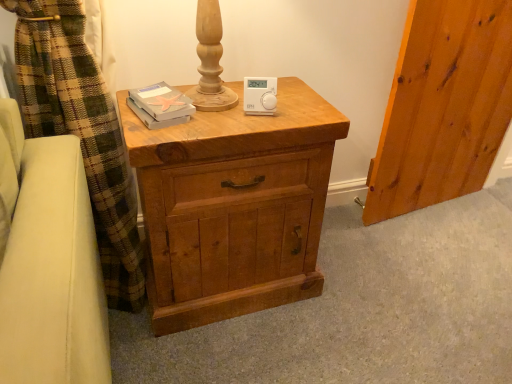
Question: Is white plastic thermostat at center behind matte wood chest of drawers at center?

Choices:
 (A) yes
 (B) no

Answer: (A)

Question: Does white plastic thermostat at center appear on the right side of matte wood chest of drawers at center?

Choices:
 (A) yes
 (B) no

Answer: (A)

Question: Does white plastic thermostat at center appear on the left side of matte wood chest of drawers at center?

Choices:
 (A) no
 (B) yes

Answer: (A)

Question: Can you see white plastic thermostat at center touching matte wood chest of drawers at center?

Choices:
 (A) yes
 (B) no

Answer: (B)

Question: From a real-world perspective, is white plastic thermostat at center beneath matte wood chest of drawers at center?

Choices:
 (A) yes
 (B) no

Answer: (B)

Question: Is white plastic thermostat at center outside matte wood chest of drawers at center?

Choices:
 (A) yes
 (B) no

Answer: (A)

Question: Is white plastic thermostat at center at the right side of matte gray book at upper left?

Choices:
 (A) no
 (B) yes

Answer: (B)

Question: Is the position of white plastic thermostat at center less distant than that of matte gray book at upper left?

Choices:
 (A) yes
 (B) no

Answer: (B)

Question: Considering the relative sizes of white plastic thermostat at center and matte gray book at upper left in the image provided, is white plastic thermostat at center wider than matte gray book at upper left?

Choices:
 (A) yes
 (B) no

Answer: (B)

Question: From the image's perspective, would you say white plastic thermostat at center is shown under matte gray book at upper left?

Choices:
 (A) yes
 (B) no

Answer: (B)

Question: Can you confirm if white plastic thermostat at center is taller than matte gray book at upper left?

Choices:
 (A) no
 (B) yes

Answer: (B)

Question: Is white plastic thermostat at center oriented away from matte gray book at upper left?

Choices:
 (A) no
 (B) yes

Answer: (A)

Question: Is matte wood chest of drawers at center touching white plastic thermostat at center?

Choices:
 (A) no
 (B) yes

Answer: (A)